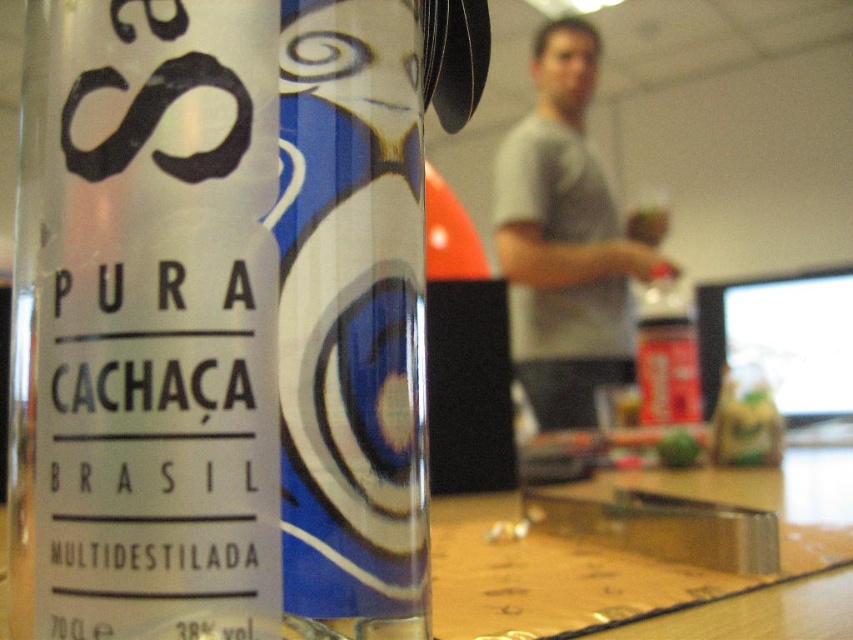
You are a customer at a bar and you want to order a drink. You see the clear glass bottle at center and the gray cotton shirt at upper center. Which object is closer to you?

The clear glass bottle at center is closer to you because it is in front of the gray cotton shirt at upper center.